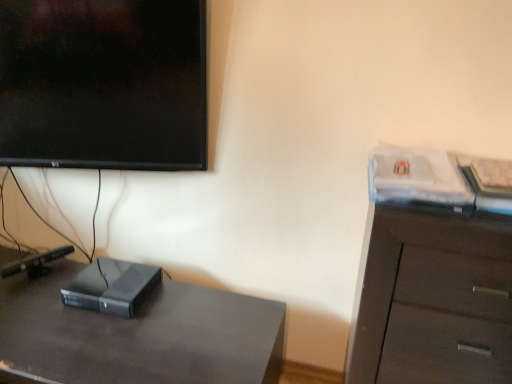
I want to click on free space above black matte desk at lower left (from a real-world perspective), so click(x=98, y=320).